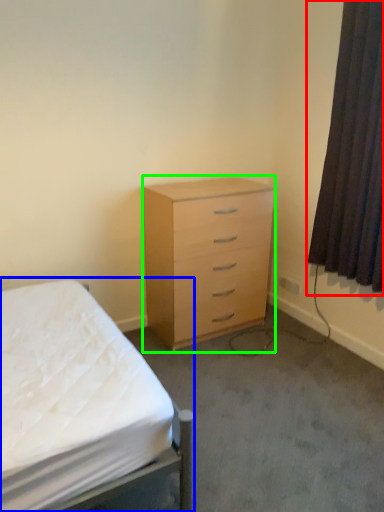
Question: Which is nearer to the curtain (highlighted by a red box)? bed (highlighted by a blue box) or chest of drawers (highlighted by a green box).

Choices:
 (A) bed
 (B) chest of drawers

Answer: (B)